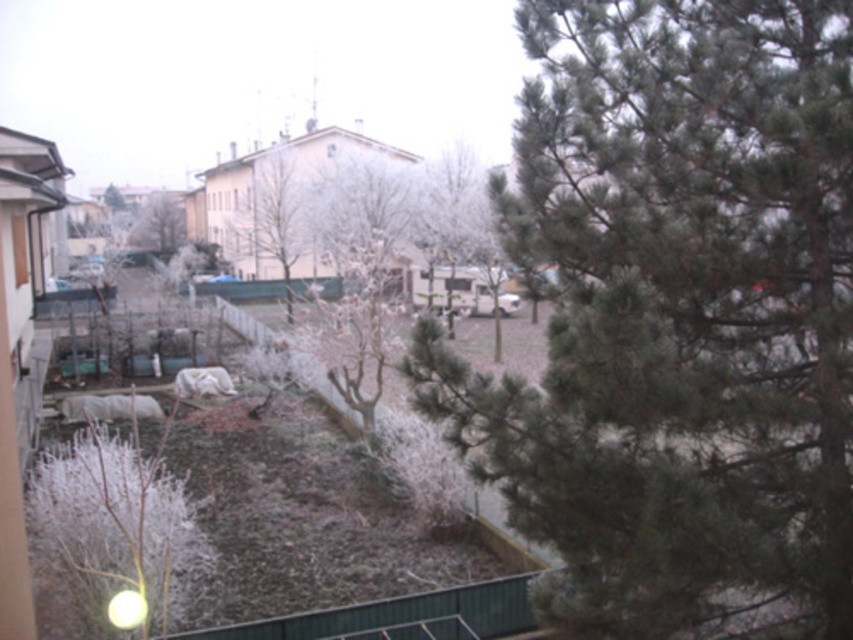
Which of these two, white frosty branch at lower left or white frosty tree at center, stands shorter?

With less height is white frosty branch at lower left.

Can you confirm if white frosty branch at lower left is shorter than white frosty tree at center?

Yes, white frosty branch at lower left is shorter than white frosty tree at center.

Which is in front, point (184, 602) or point (170, 230)?

Point (184, 602) is in front.

Identify the location of white frosty branch at lower left. This screenshot has width=853, height=640. (117, 529).

Does green needle-like tree at right come behind green matte tree at center?

That is False.

What do you see at coordinates (677, 317) in the screenshot?
I see `green needle-like tree at right` at bounding box center [677, 317].

Is point (537, 486) positioned in front of point (119, 205)?

Yes, it is.

In order to click on green needle-like tree at right in this screenshot , I will do `click(677, 317)`.

Who is positioned more to the left, white frosty branch at lower left or bare wood tree at center?

bare wood tree at center

Where is `white frosty branch at lower left`? Image resolution: width=853 pixels, height=640 pixels. white frosty branch at lower left is located at coordinates (117, 529).